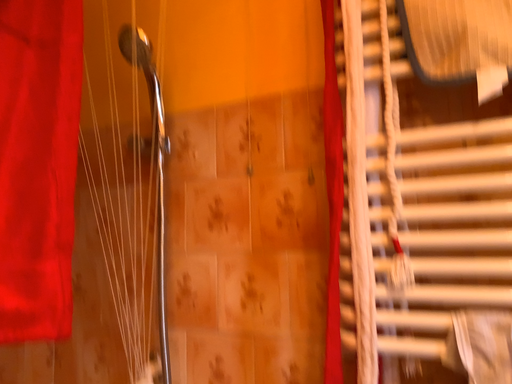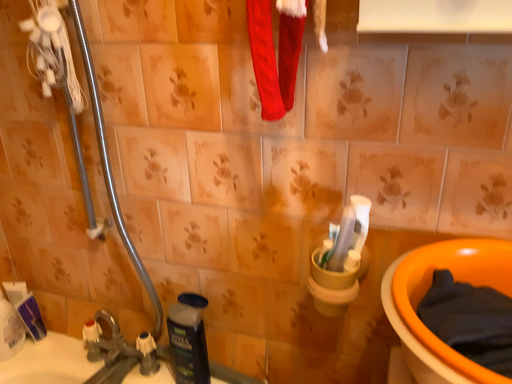
Question: How did the camera likely rotate when shooting the video?

Choices:
 (A) rotated upward
 (B) rotated downward

Answer: (B)